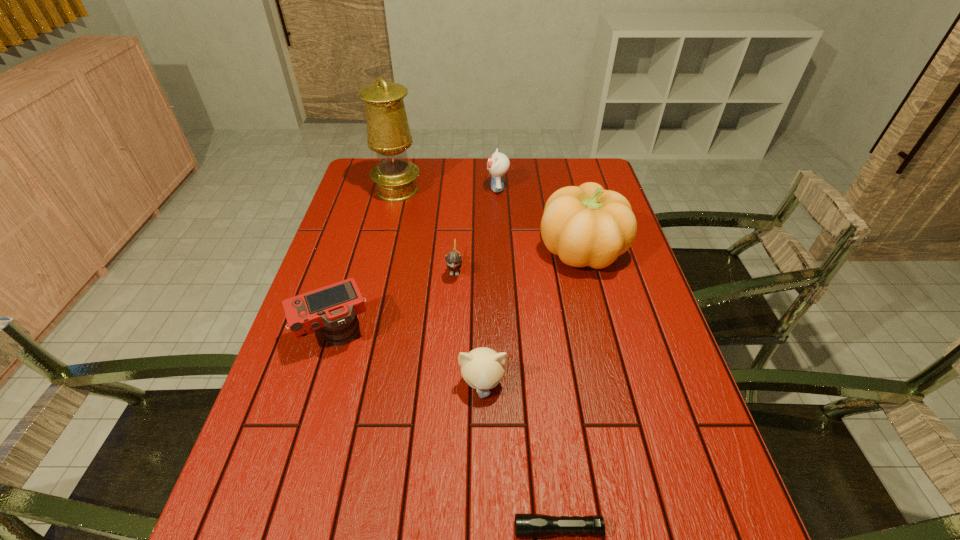
The image size is (960, 540). Identify the location of oil lamp. (388, 132).

You are a GUI agent. You are given a task and a screenshot of the screen. Output one action in this format:
    pyautogui.click(x=<x>, y=<y>)
    Task: Click on the second tallest object
    The height and width of the screenshot is (540, 960).
    Given the screenshot: What is the action you would take?
    tap(585, 226)

At what (x,y) coordinates should I click in order to perform the action: click on the farthest kitten. Please return your answer as a coordinate pair (x, y). This screenshot has width=960, height=540. Looking at the image, I should click on click(498, 164).

Locate an element on the screen. the third nearest object is located at coordinates (333, 308).

You are a GUI agent. You are given a task and a screenshot of the screen. Output one action in this format:
    pyautogui.click(x=<x>, y=<y>)
    Task: Click on the sixth farthest object
    The height and width of the screenshot is (540, 960).
    Given the screenshot: What is the action you would take?
    pyautogui.click(x=482, y=368)

I want to click on the second shortest kitten, so click(x=482, y=368).

Where is `the sixth tallest object`? This screenshot has width=960, height=540. the sixth tallest object is located at coordinates (453, 259).

This screenshot has height=540, width=960. What are the coordinates of `the shortest kitten` in the screenshot? It's located at (453, 259).

Find the location of `free space located 0.100m on the right of the oil lamp`. free space located 0.100m on the right of the oil lamp is located at coordinates (449, 191).

The height and width of the screenshot is (540, 960). In order to click on vacant region located on the front of the pumpkin in this screenshot , I will do `click(606, 340)`.